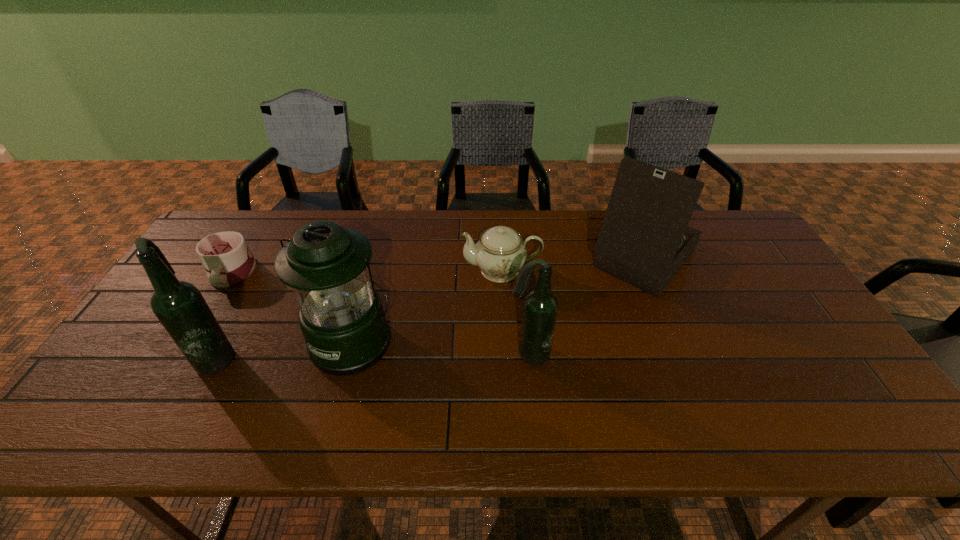
The image size is (960, 540). I want to click on vacant point located at the spout of the second shortest object, so click(358, 270).

The height and width of the screenshot is (540, 960). I want to click on blank space located 0.300m at the spout of the second shortest object, so click(x=365, y=270).

The height and width of the screenshot is (540, 960). Find the location of `vacant space situated 0.070m at the spout of the second shortest object`. vacant space situated 0.070m at the spout of the second shortest object is located at coordinates (440, 270).

Locate an element on the screen. Image resolution: width=960 pixels, height=540 pixels. vacant point located 0.260m on the right of the third object from left to right is located at coordinates (494, 341).

Locate an element on the screen. free location located on the side with the handle of the shortest object is located at coordinates (189, 345).

This screenshot has height=540, width=960. In order to click on phonograph record present at the far edge in this screenshot , I will do `click(644, 240)`.

This screenshot has width=960, height=540. I want to click on chinaware positioned at the far edge, so click(x=500, y=253).

The image size is (960, 540). Identify the location of beer bottle at the near edge. (180, 307).

At what (x,y) coordinates should I click in order to perform the action: click on lantern that is at the near edge. Please return your answer as a coordinate pair (x, y). This screenshot has width=960, height=540. Looking at the image, I should click on (341, 316).

At what (x,y) coordinates should I click in order to perform the action: click on object at the left edge. Please return your answer as a coordinate pair (x, y). The width and height of the screenshot is (960, 540). Looking at the image, I should click on (227, 260).